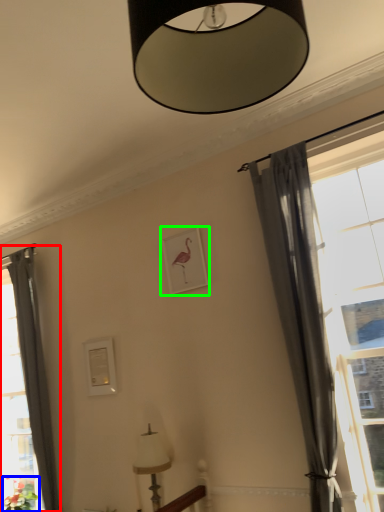
Question: Considering the real-world distances, which object is farthest from curtain (highlighted by a red box)? plant (highlighted by a blue box) or picture frame (highlighted by a green box)?

Choices:
 (A) plant
 (B) picture frame

Answer: (B)